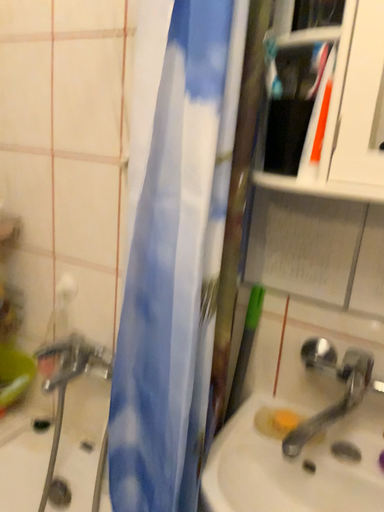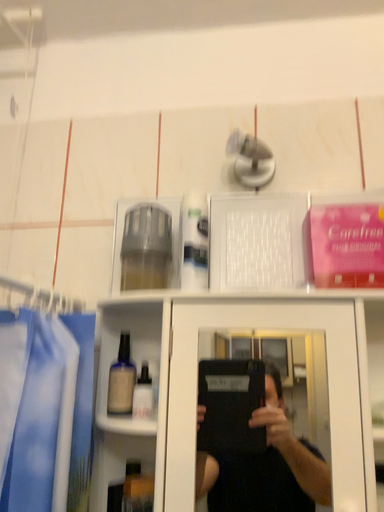
Question: How did the camera likely rotate when shooting the video?

Choices:
 (A) rotated left
 (B) rotated right

Answer: (B)